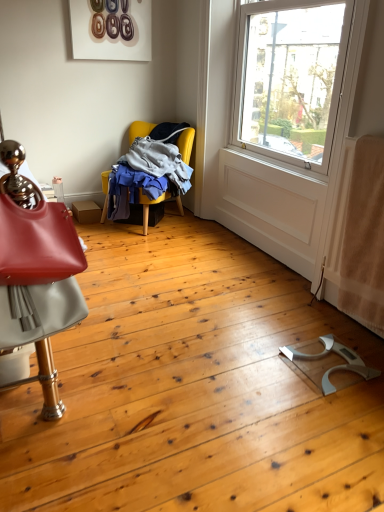
Question: Considering the positions of point (56, 276) and point (142, 194), is point (56, 276) closer or farther from the camera than point (142, 194)?

Choices:
 (A) farther
 (B) closer

Answer: (B)

Question: From the image's perspective, relative to yellow fabric chair at upper left, the second chair viewed from the front, is matte red chair at left, positioned as the first chair in bottom-to-top order, above or below?

Choices:
 (A) above
 (B) below

Answer: (B)

Question: In the image, is matte red chair at left, which is counted as the second chair, starting from the back, on the left side or the right side of yellow fabric chair at upper left, positioned as the first chair in back-to-front order?

Choices:
 (A) right
 (B) left

Answer: (B)

Question: Is point (148, 122) closer or farther from the camera than point (29, 284)?

Choices:
 (A) farther
 (B) closer

Answer: (A)

Question: From a real-world perspective, is yellow fabric chair at upper left, the second chair viewed from the front, above or below matte red chair at left, which is counted as the second chair, starting from the back?

Choices:
 (A) below
 (B) above

Answer: (A)

Question: From the image's perspective, relative to matte red chair at left, positioned as the first chair in bottom-to-top order, is yellow fabric chair at upper left, the second chair viewed from the front, above or below?

Choices:
 (A) above
 (B) below

Answer: (A)

Question: In the image, is yellow fabric chair at upper left, the second chair ordered from the bottom, positioned in front of or behind matte red chair at left, positioned as the first chair in bottom-to-top order?

Choices:
 (A) front
 (B) behind

Answer: (B)